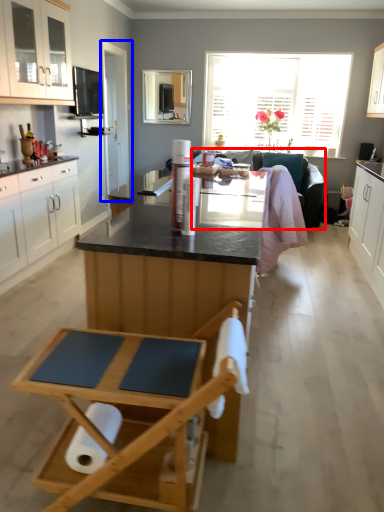
Question: Which object is further to the camera taking this photo, couch (highlighted by a red box) or glass door (highlighted by a blue box)?

Choices:
 (A) couch
 (B) glass door

Answer: (B)